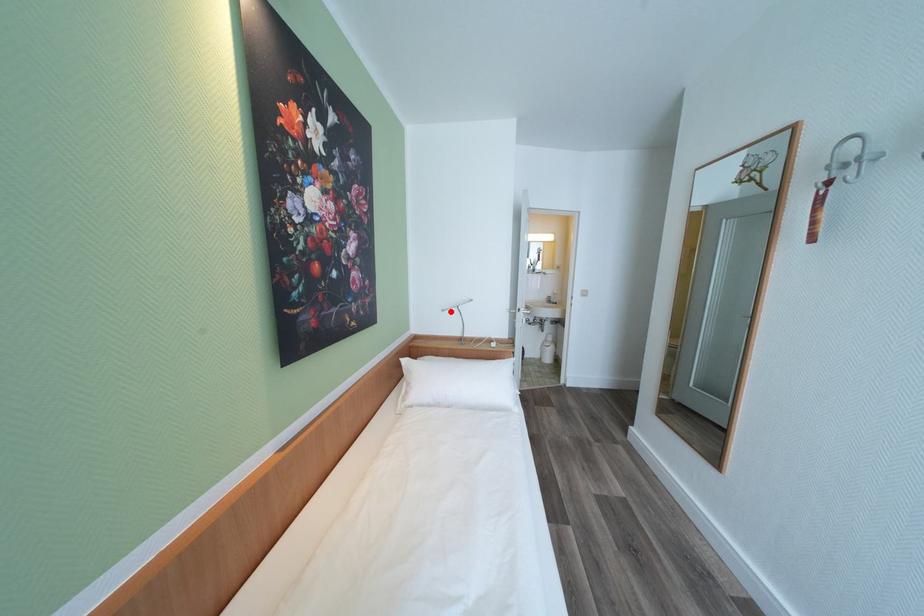
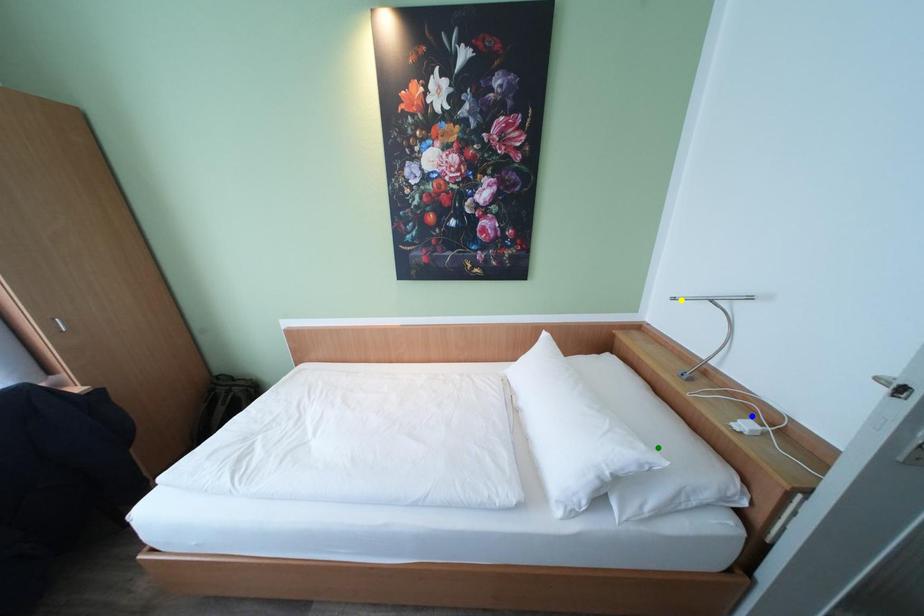
Question: I am providing you with two images of the same scene from different viewpoints. A red point is marked on the first image. You are given multiple points on the second image. Can you choose the point in image 2 that corresponds to the point in image 1?

Choices:
 (A) green point
 (B) blue point
 (C) yellow point

Answer: (C)